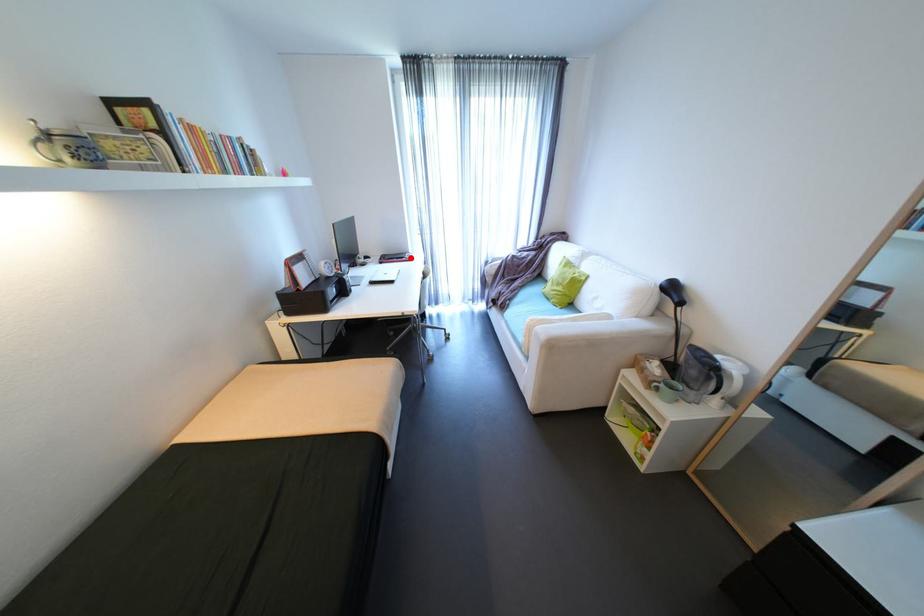
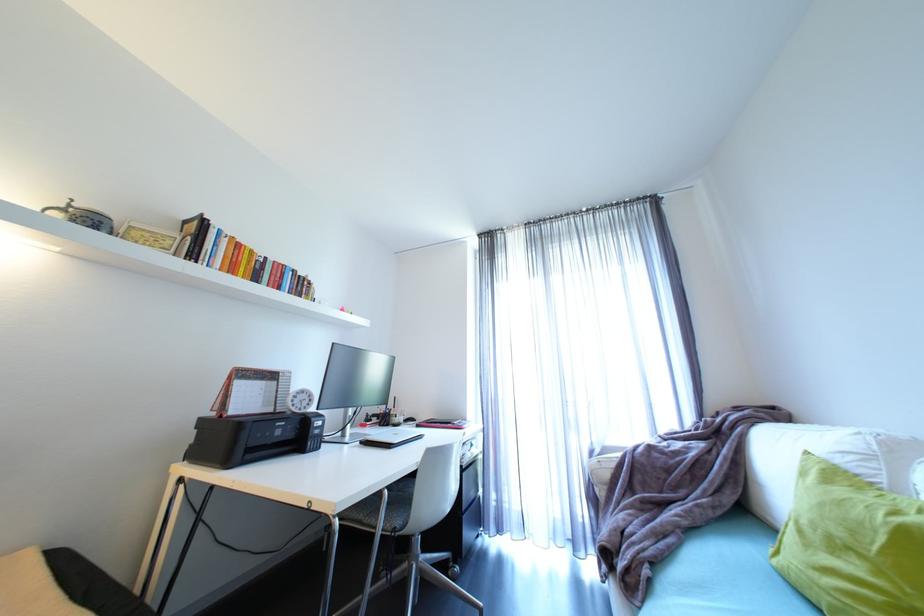
Question: I am providing you with two images of the same scene from different viewpoints. A red point is marked on the first image. At the location where the point appears in image 1, is it still visible in image 2?

Choices:
 (A) Yes
 (B) No

Answer: (A)